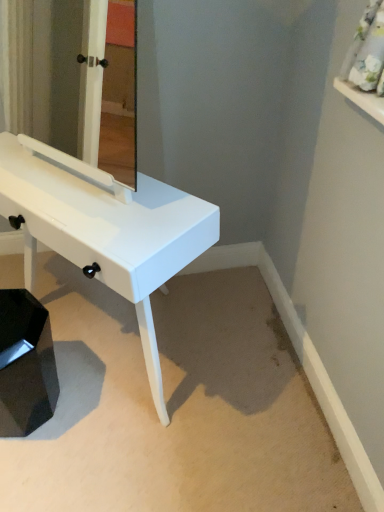
Locate an element on the screen. free point below white glossy table at center (from a real-world perspective) is located at coordinates pyautogui.click(x=102, y=351).